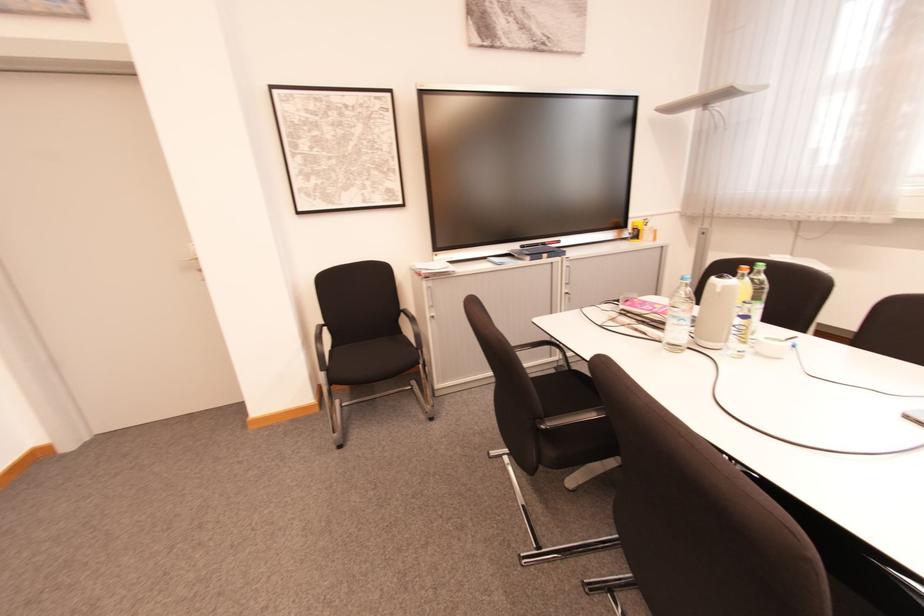
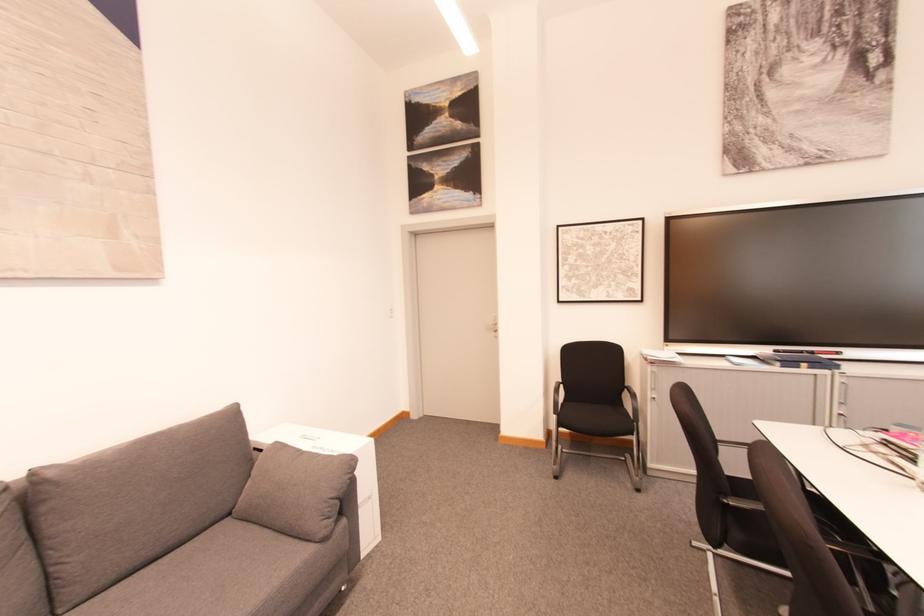
Question: The first image is from the beginning of the video and the second image is from the end. How did the camera likely rotate when shooting the video?

Choices:
 (A) Left
 (B) Right
 (C) Up
 (D) Down

Answer: (A)